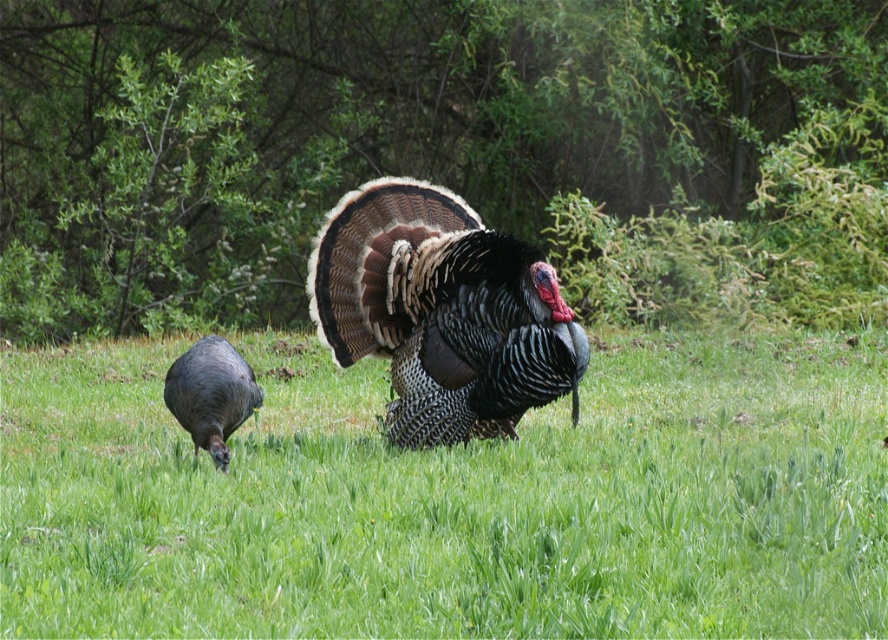
Is green grass at center above shiny dark gray turkey at lower left?

No, green grass at center is not above shiny dark gray turkey at lower left.

What do you see at coordinates (453, 499) in the screenshot?
I see `green grass at center` at bounding box center [453, 499].

Who is more distant from viewer, (x=865, y=344) or (x=213, y=348)?

The point (x=865, y=344) is behind.

Locate an element on the screen. The width and height of the screenshot is (888, 640). green grass at center is located at coordinates (453, 499).

The height and width of the screenshot is (640, 888). What do you see at coordinates (453, 499) in the screenshot?
I see `green grass at center` at bounding box center [453, 499].

Does green grass at center have a lesser width compared to shiny iridescent turkey at center?

Correct, green grass at center's width is less than shiny iridescent turkey at center's.

Does point (347, 548) come farther from viewer compared to point (381, 252)?

No, it is not.

Find the location of a particular element. The height and width of the screenshot is (640, 888). green grass at center is located at coordinates (453, 499).

Does shiny iridescent turkey at center have a larger size compared to shiny dark gray turkey at lower left?

Yes, shiny iridescent turkey at center is bigger than shiny dark gray turkey at lower left.

Which of these two, shiny iridescent turkey at center or shiny dark gray turkey at lower left, stands taller?

With more height is shiny iridescent turkey at center.

What are the coordinates of `shiny iridescent turkey at center` in the screenshot? It's located at (442, 312).